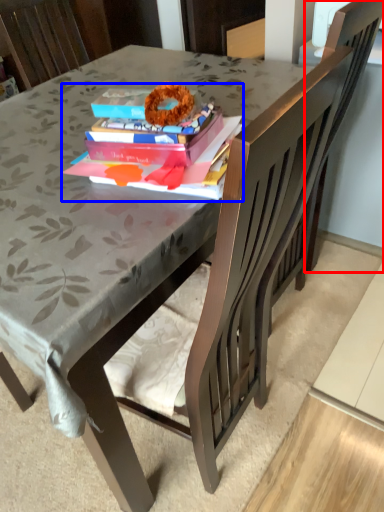
Question: Which of the following is the closest to the observer, swivel chair (highlighted by a red box) or book (highlighted by a blue box)?

Choices:
 (A) swivel chair
 (B) book

Answer: (B)